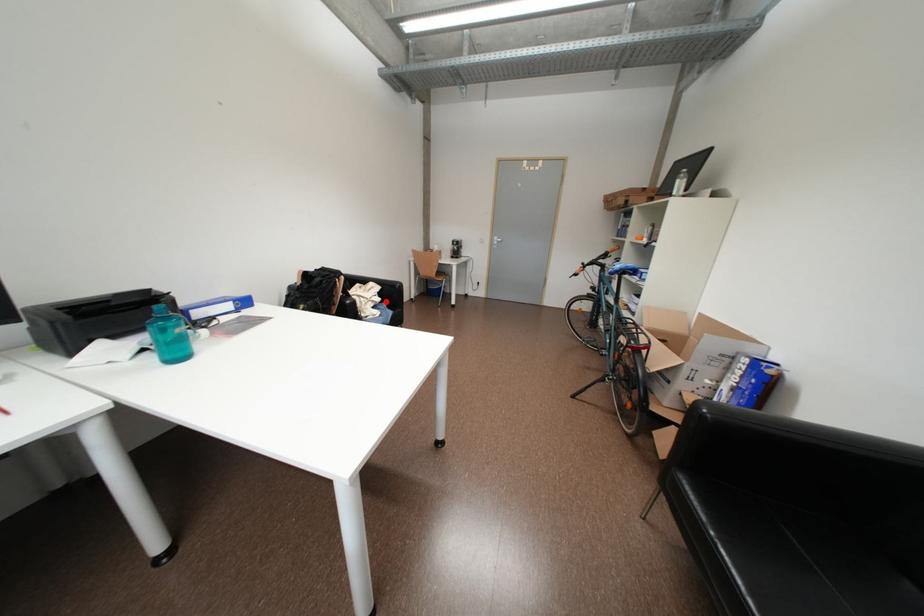
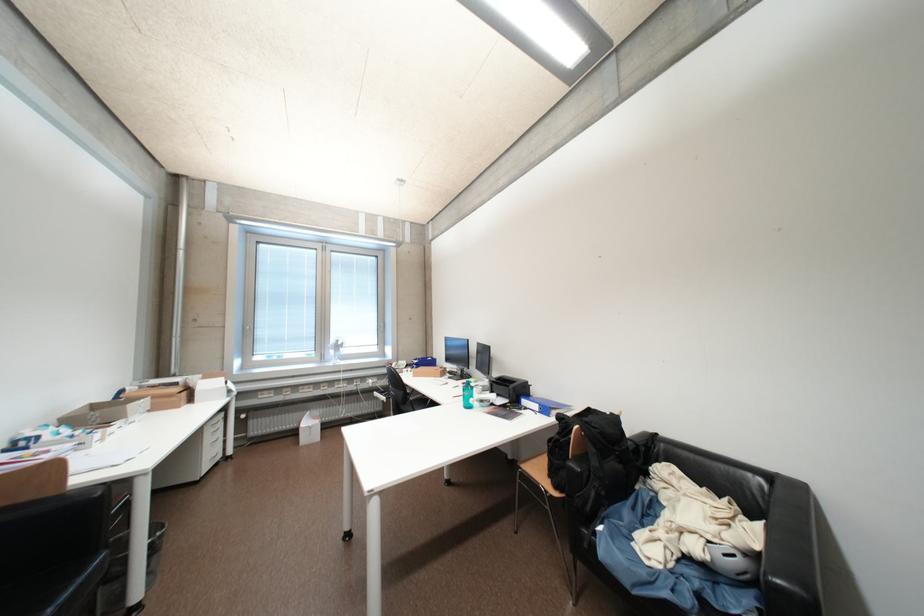
The point at the highlighted location is marked in the first image. Where is the corresponding point in the second image?

(704, 551)